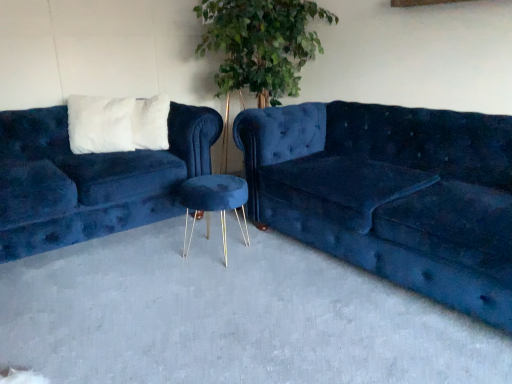
Question: Is velvet blue couch at left, marked as the 2th studio couch in a right-to-left arrangement, facing towards blue velvet stool at center?

Choices:
 (A) yes
 (B) no

Answer: (A)

Question: Does velvet blue couch at left, which ranks as the first studio couch in left-to-right order, touch blue velvet stool at center?

Choices:
 (A) yes
 (B) no

Answer: (B)

Question: Is velvet blue couch at left, which ranks as the first studio couch in left-to-right order, bigger than blue velvet stool at center?

Choices:
 (A) yes
 (B) no

Answer: (A)

Question: Can you confirm if velvet blue couch at left, marked as the 2th studio couch in a right-to-left arrangement, is positioned to the right of blue velvet stool at center?

Choices:
 (A) no
 (B) yes

Answer: (A)

Question: Is velvet blue couch at left, which ranks as the first studio couch in left-to-right order, oriented away from blue velvet stool at center?

Choices:
 (A) no
 (B) yes

Answer: (A)

Question: Is velvet blue couch at left, which ranks as the first studio couch in left-to-right order, positioned behind blue velvet stool at center?

Choices:
 (A) no
 (B) yes

Answer: (B)

Question: Does velvet blue stool at center have a greater height compared to blue velvet stool at center?

Choices:
 (A) no
 (B) yes

Answer: (B)

Question: Is velvet blue stool at center thinner than blue velvet stool at center?

Choices:
 (A) yes
 (B) no

Answer: (A)

Question: From the image's perspective, does velvet blue stool at center appear higher than blue velvet stool at center?

Choices:
 (A) yes
 (B) no

Answer: (A)

Question: Is velvet blue stool at center bigger than blue velvet stool at center?

Choices:
 (A) no
 (B) yes

Answer: (A)

Question: From a real-world perspective, is velvet blue stool at center positioned under blue velvet stool at center based on gravity?

Choices:
 (A) no
 (B) yes

Answer: (A)

Question: Is velvet blue stool at center surrounding blue velvet stool at center?

Choices:
 (A) yes
 (B) no

Answer: (B)

Question: From a real-world perspective, is velvet blue couch at center, which ranks as the 1th studio couch in right-to-left order, on top of blue velvet stool at center?

Choices:
 (A) yes
 (B) no

Answer: (A)